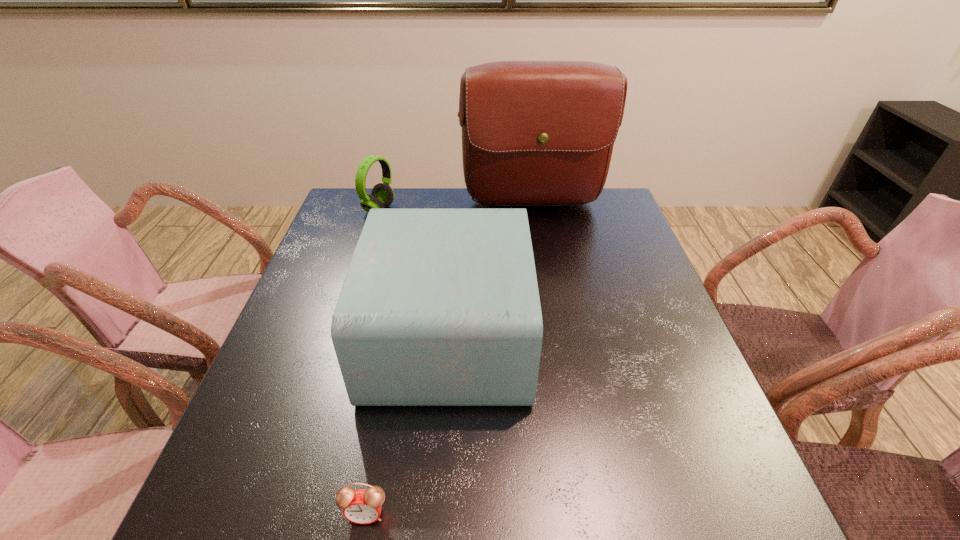
I want to click on free location that satisfies the following two spatial constraints: 1. on the open flap of the tallest object; 2. on the front panel of the radio receiver, so click(555, 335).

Image resolution: width=960 pixels, height=540 pixels. Find the location of `vacant space that satisfies the following two spatial constraints: 1. on the open flap of the satchel; 2. on the front panel of the second nearest object`. vacant space that satisfies the following two spatial constraints: 1. on the open flap of the satchel; 2. on the front panel of the second nearest object is located at coordinates (555, 335).

Locate an element on the screen. free spot that satisfies the following two spatial constraints: 1. on the open flap of the satchel; 2. on the front panel of the third farthest object is located at coordinates (555, 335).

Where is `free location that satisfies the following two spatial constraints: 1. on the front panel of the radio receiver; 2. on the clock face of the nearest object`? free location that satisfies the following two spatial constraints: 1. on the front panel of the radio receiver; 2. on the clock face of the nearest object is located at coordinates (438, 514).